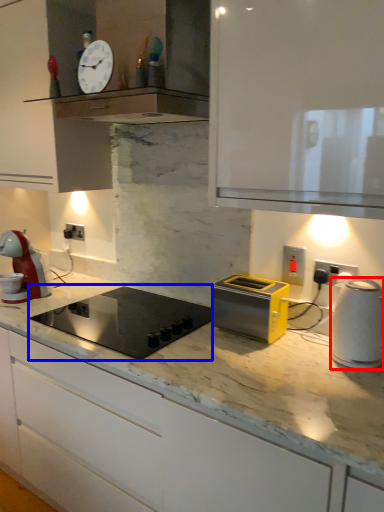
Question: Which object is closer to the camera taking this photo, kitchen appliance (highlighted by a red box) or home appliance (highlighted by a blue box)?

Choices:
 (A) kitchen appliance
 (B) home appliance

Answer: (A)